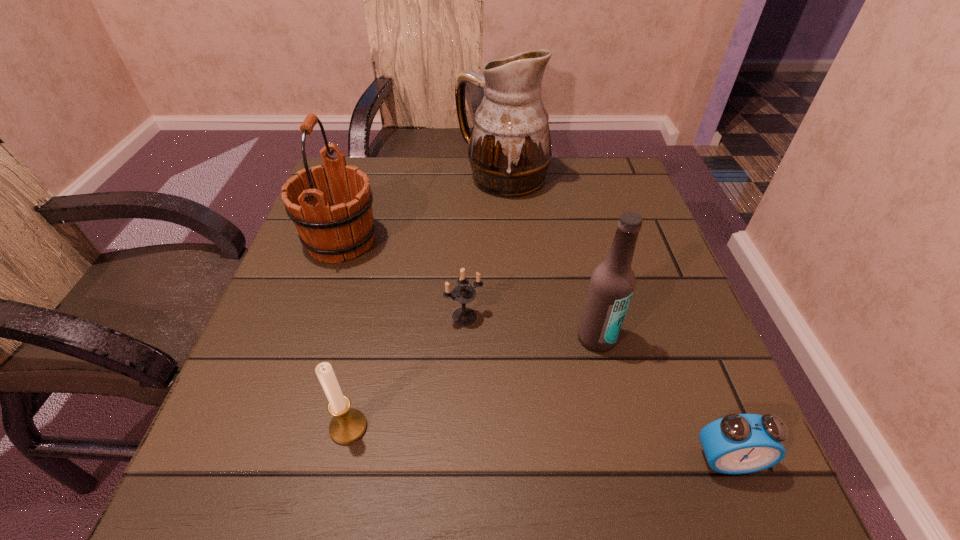
Find the location of a particular element. Image resolution: width=960 pixels, height=540 pixels. unoccupied position between the fifth nearest object and the right candle holder is located at coordinates (403, 279).

Image resolution: width=960 pixels, height=540 pixels. In order to click on empty space between the farthest object and the beer bottle in this screenshot , I will do `click(549, 258)`.

Locate an element on the screen. This screenshot has height=540, width=960. vacant space that is in between the right candle holder and the second farthest object is located at coordinates (403, 279).

Find the location of `vacant area between the shorter candle holder and the pitcher`. vacant area between the shorter candle holder and the pitcher is located at coordinates (484, 247).

This screenshot has width=960, height=540. Identify the location of vacant area between the left candle holder and the beer bottle. (472, 383).

Locate an element on the screen. The width and height of the screenshot is (960, 540). unoccupied position between the fifth nearest object and the pitcher is located at coordinates (421, 209).

Find the location of a particular element. object that is the third closest to the wine bucket is located at coordinates (348, 425).

Find the location of a particular element. The height and width of the screenshot is (540, 960). the closest object to the alarm clock is located at coordinates (612, 283).

Image resolution: width=960 pixels, height=540 pixels. In order to click on vacant space that satisfies the following two spatial constraints: 1. from the spout of the pitcher; 2. on the front side of the nearer candle holder in this screenshot , I will do `click(519, 427)`.